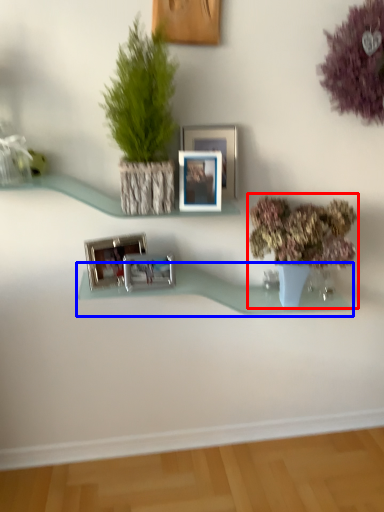
Question: Which object appears farthest to the camera in this image, houseplant (highlighted by a red box) or shelf (highlighted by a blue box)?

Choices:
 (A) houseplant
 (B) shelf

Answer: (B)